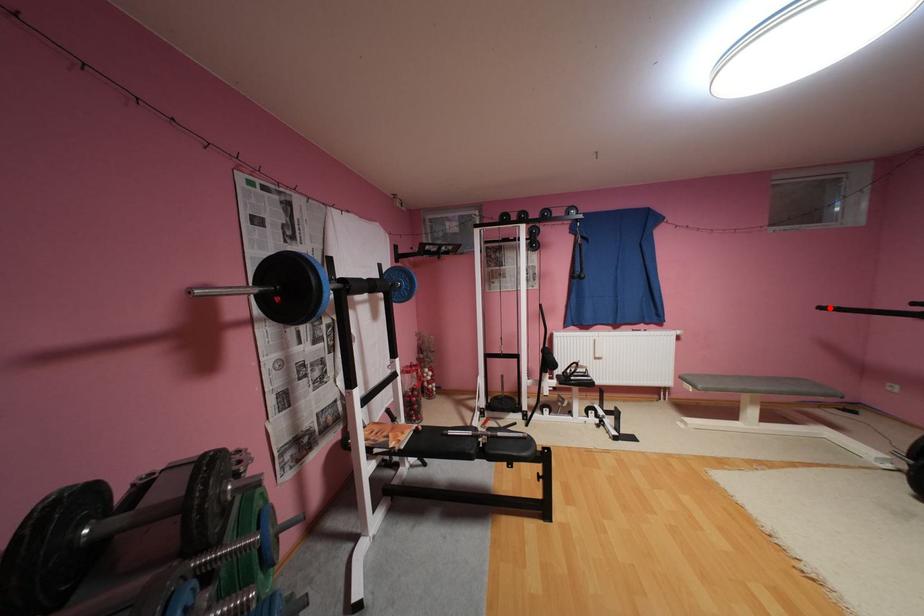
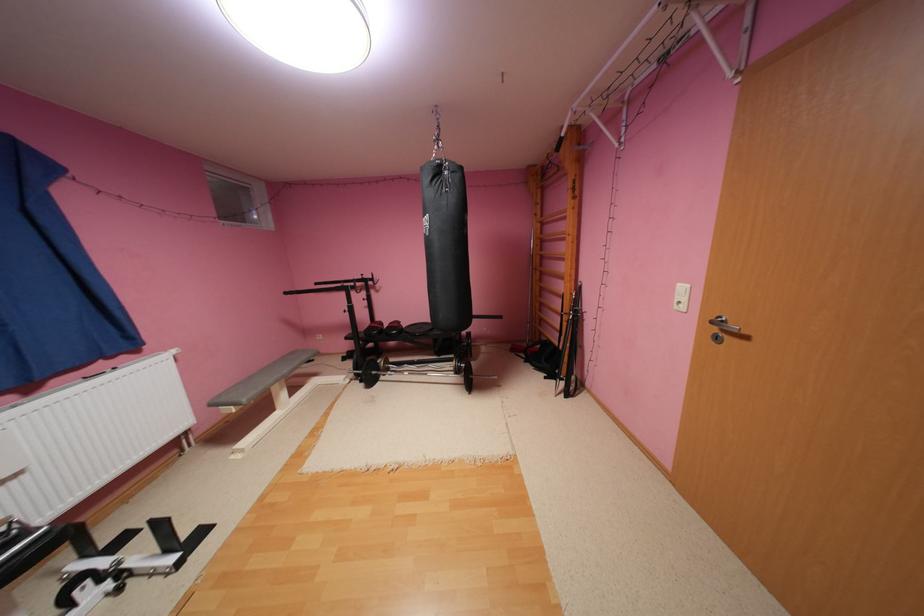
Question: I am providing you with two images of the same scene from different viewpoints. In image1, a red point is highlighted. Considering the same 3D point in image2, which of the following is correct?

Choices:
 (A) It is closer
 (B) It is farther

Answer: (A)